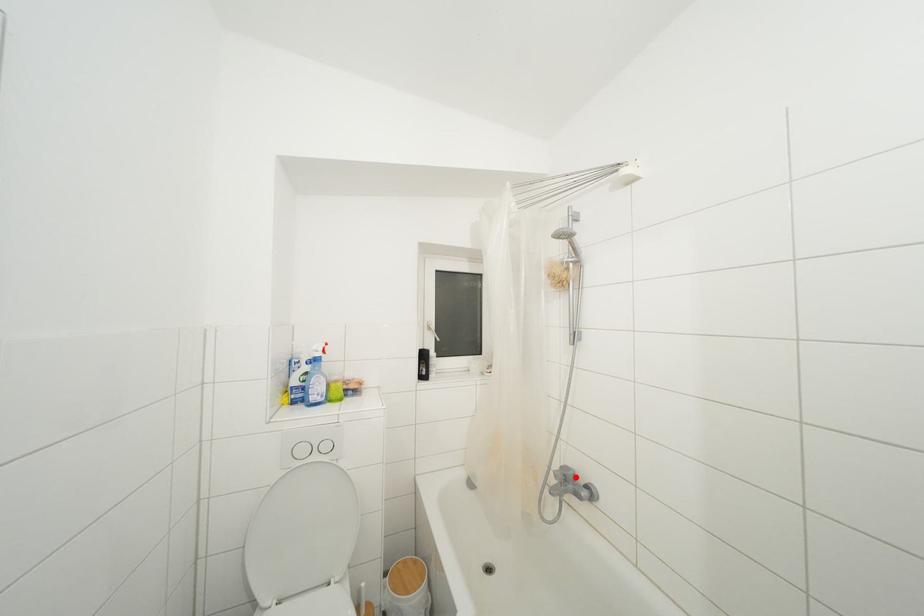
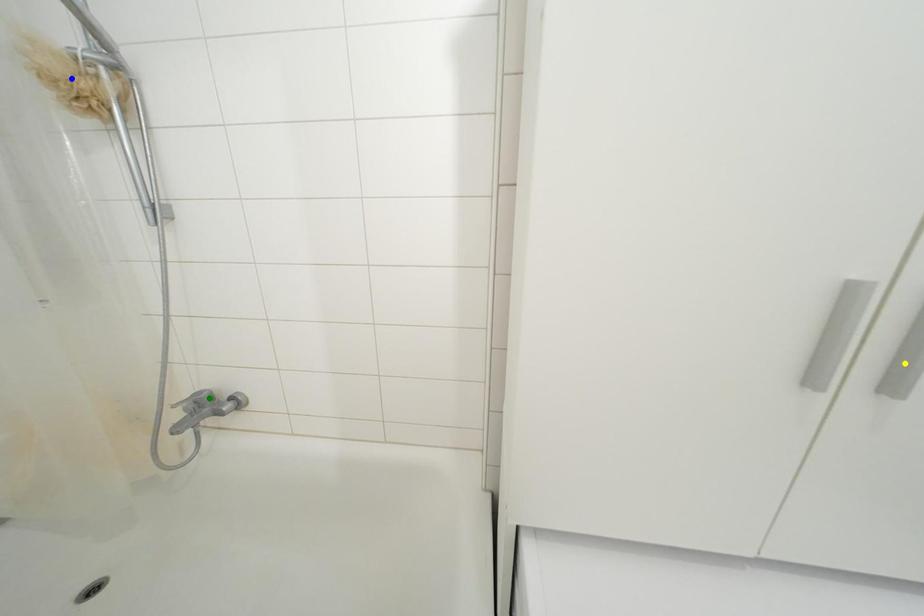
Question: I am providing you with two images of the same scene from different viewpoints. A red point is marked on the first image. You are given multiple points on the second image. Which point in image 2 represents the same 3d spot as the red point in image 1?

Choices:
 (A) yellow point
 (B) green point
 (C) blue point

Answer: (B)